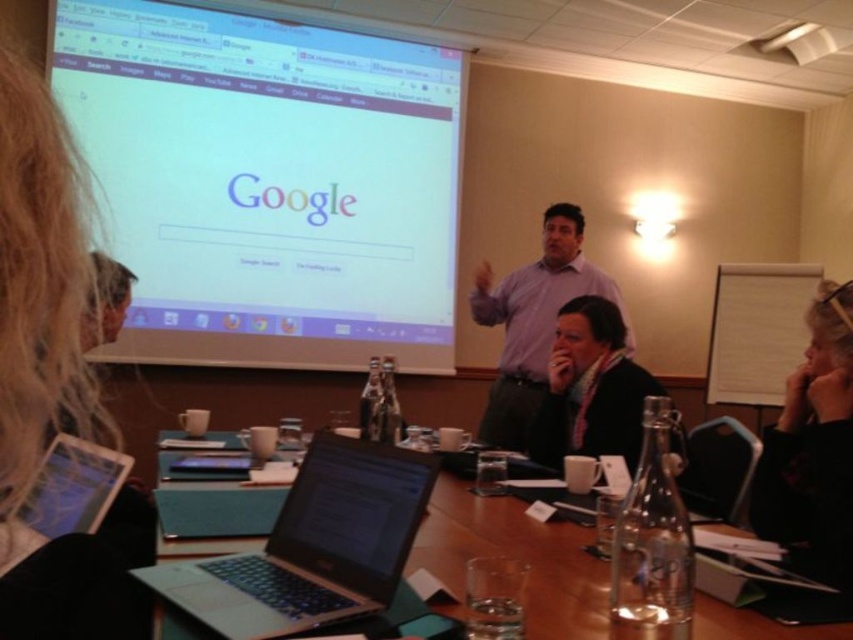
Does point (239, 611) come closer to viewer compared to point (589, 442)?

Yes, it is.

Can you confirm if silver metallic laptop at center is positioned to the right of dark gray sweater at lower center?

In fact, silver metallic laptop at center is to the left of dark gray sweater at lower center.

The image size is (853, 640). What do you see at coordinates (312, 547) in the screenshot?
I see `silver metallic laptop at center` at bounding box center [312, 547].

You are a GUI agent. You are given a task and a screenshot of the screen. Output one action in this format:
    pyautogui.click(x=<x>, y=<y>)
    Task: Click on the silver metallic laptop at center
    Image resolution: width=853 pixels, height=640 pixels.
    Given the screenshot: What is the action you would take?
    pyautogui.click(x=312, y=547)

Is matte plastic projector screen at upper left positioned before silver metallic laptop at center?

No.

Does point (254, 97) lie behind point (281, 602)?

Yes, it is.

At what (x,y) coordinates should I click in order to perform the action: click on matte plastic projector screen at upper left. Please return your answer as a coordinate pair (x, y). This screenshot has width=853, height=640. Looking at the image, I should click on (267, 180).

Which is above, matte plastic projector screen at upper left or purple shirt at center?

matte plastic projector screen at upper left

Does point (320, 230) lie in front of point (479, 321)?

That is False.

Which is in front, point (138, 266) or point (546, 216)?

Point (546, 216) is in front.

Find the location of a particular element. The width and height of the screenshot is (853, 640). matte plastic projector screen at upper left is located at coordinates (267, 180).